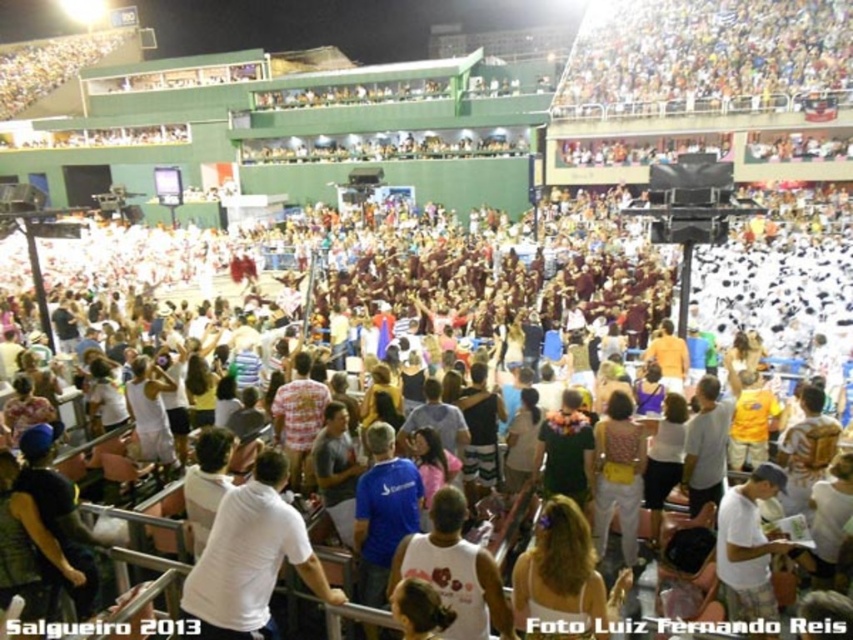
Does white matte shirt at center appear under white cotton shirt at center?

No.

Between point (254, 564) and point (468, 605), which one is positioned behind?

The point (254, 564) is behind.

Find the location of a particular element. The image size is (853, 640). white matte shirt at center is located at coordinates (250, 557).